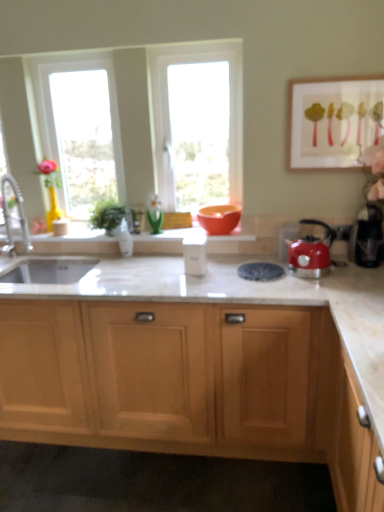
Locate an element on the screen. Image resolution: width=384 pixels, height=512 pixels. free spot in front of white glossy container at center is located at coordinates (192, 285).